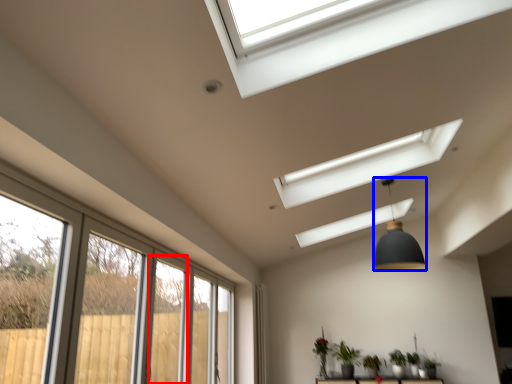
Question: Among these objects, which one is farthest to the camera, screen door (highlighted by a red box) or light fixture (highlighted by a blue box)?

Choices:
 (A) screen door
 (B) light fixture

Answer: (B)